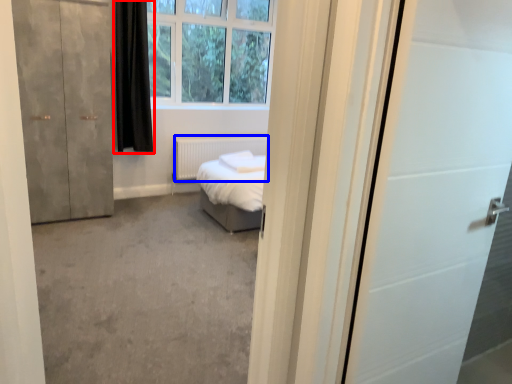
Question: Which object appears closest to the camera in this image, curtain (highlighted by a red box) or radiator (highlighted by a blue box)?

Choices:
 (A) curtain
 (B) radiator

Answer: (A)